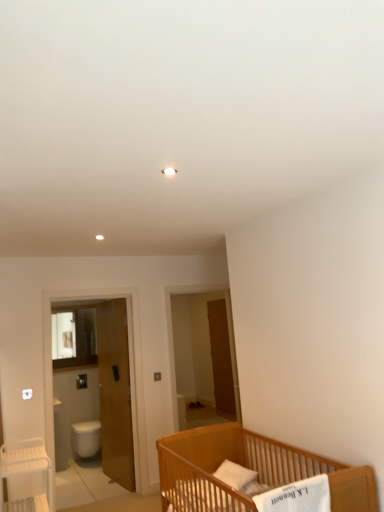
Question: Are white glossy screen door at left, marked as the first screen door in a front-to-back arrangement, and white plastic table at lower left located far from each other?

Choices:
 (A) no
 (B) yes

Answer: (B)

Question: Is white glossy screen door at left, marked as the first screen door in a front-to-back arrangement, positioned beyond the bounds of white plastic table at lower left?

Choices:
 (A) yes
 (B) no

Answer: (A)

Question: Could you tell me if white glossy screen door at left, which is the second screen door from right to left, is turned towards white plastic table at lower left?

Choices:
 (A) yes
 (B) no

Answer: (B)

Question: Is the depth of white glossy screen door at left, placed as the 1th screen door when sorted from left to right, less than that of white plastic table at lower left?

Choices:
 (A) no
 (B) yes

Answer: (A)

Question: From the image's perspective, is white glossy screen door at left, the 2th screen door positioned from the back, under white plastic table at lower left?

Choices:
 (A) no
 (B) yes

Answer: (A)

Question: Is white plastic table at lower left in front of or behind brown wooden screen door at center, placed as the 2th screen door when sorted from left to right, in the image?

Choices:
 (A) front
 (B) behind

Answer: (A)

Question: Considering the positions of white plastic table at lower left and brown wooden screen door at center, placed as the 2th screen door when sorted from left to right, in the image, is white plastic table at lower left bigger or smaller than brown wooden screen door at center, placed as the 2th screen door when sorted from left to right,?

Choices:
 (A) big
 (B) small

Answer: (A)

Question: From their relative heights in the image, would you say white plastic table at lower left is taller or shorter than brown wooden screen door at center, placed as the 2th screen door when sorted from left to right?

Choices:
 (A) tall
 (B) short

Answer: (B)

Question: Is point (11, 474) positioned closer to the camera than point (213, 312)?

Choices:
 (A) closer
 (B) farther

Answer: (A)

Question: From a real-world perspective, relative to white glossy toilet bowl at lower left, is wooden door at left vertically above or below?

Choices:
 (A) above
 (B) below

Answer: (A)

Question: In terms of height, does wooden door at left look taller or shorter compared to white glossy toilet bowl at lower left?

Choices:
 (A) tall
 (B) short

Answer: (A)

Question: Is wooden door at left spatially inside white glossy toilet bowl at lower left, or outside of it?

Choices:
 (A) outside
 (B) inside

Answer: (A)

Question: Is wooden door at left bigger or smaller than white glossy toilet bowl at lower left?

Choices:
 (A) big
 (B) small

Answer: (A)

Question: From a real-world perspective, is wooden door at left positioned above or below brown wooden screen door at center, the 2th screen door when ordered from front to back?

Choices:
 (A) below
 (B) above

Answer: (A)

Question: From their relative heights in the image, would you say wooden door at left is taller or shorter than brown wooden screen door at center, which ranks as the first screen door in back-to-front order?

Choices:
 (A) short
 (B) tall

Answer: (B)